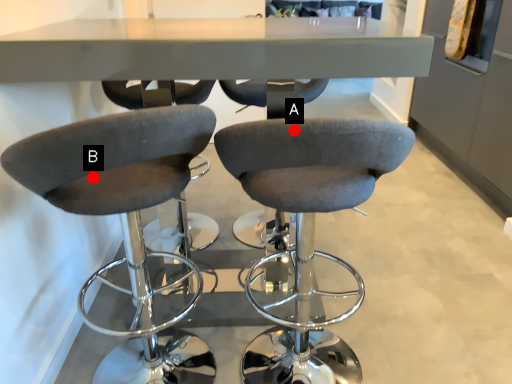
Question: Two points are circled on the image, labeled by A and B beside each circle. Which point is farther from the camera taking this photo?

Choices:
 (A) A is further
 (B) B is further

Answer: (B)